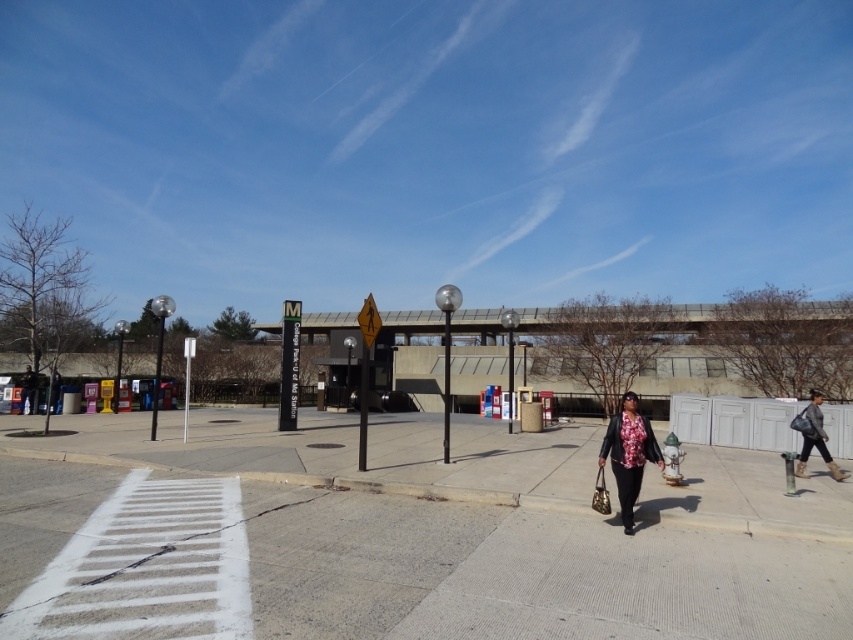
Question: Which of these objects is positioned farthest from the matte black jacket at center?

Choices:
 (A) leather jacket at lower right
 (B) white asphalt at lower left

Answer: (A)

Question: Does white asphalt at lower left appear over leather jacket at lower right?

Choices:
 (A) no
 (B) yes

Answer: (B)

Question: Among these points, which one is nearest to the camera?

Choices:
 (A) (830, 560)
 (B) (630, 442)
 (C) (817, 445)

Answer: (A)

Question: Observing the image, what is the correct spatial positioning of white asphalt at lower left in reference to leather jacket at lower right?

Choices:
 (A) left
 (B) right

Answer: (A)

Question: Among these points, which one is nearest to the camera?

Choices:
 (A) (657, 449)
 (B) (817, 426)
 (C) (753, 625)

Answer: (C)

Question: Is white asphalt at lower left below matte black jacket at center?

Choices:
 (A) yes
 (B) no

Answer: (A)